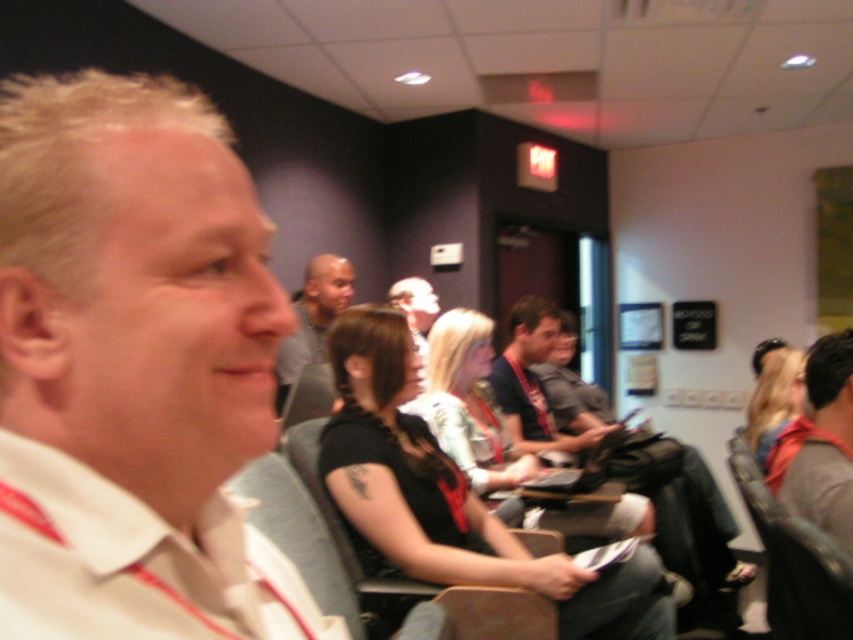
In the scene shown: Can you confirm if white cotton shirt at left is wider than gray fabric shirt at center?

No, white cotton shirt at left is not wider than gray fabric shirt at center.

Find the location of a particular element. The image size is (853, 640). white cotton shirt at left is located at coordinates (135, 563).

Which is behind, point (239, 509) or point (318, 324)?

The point (318, 324) is behind.

The height and width of the screenshot is (640, 853). I want to click on white cotton shirt at left, so click(135, 563).

Does dark blue t-shirt at center have a greater width compared to gray fabric chair at center?

Correct, the width of dark blue t-shirt at center exceeds that of gray fabric chair at center.

Can you confirm if dark blue t-shirt at center is taller than gray fabric chair at center?

Yes.

Between point (535, 520) and point (486, 637), which one is positioned in front?

Point (486, 637) is in front.

You are a GUI agent. You are given a task and a screenshot of the screen. Output one action in this format:
    pyautogui.click(x=<x>, y=<y>)
    Task: Click on the dark blue t-shirt at center
    This screenshot has width=853, height=640.
    Given the screenshot: What is the action you would take?
    pyautogui.click(x=534, y=385)

Is black leather chair at lower right in front of gray fabric shirt at center?

Yes, black leather chair at lower right is in front of gray fabric shirt at center.

Is point (811, 618) farther from camera compared to point (297, 369)?

No, (811, 618) is in front of (297, 369).

Locate an element on the screen. black leather chair at lower right is located at coordinates pyautogui.click(x=793, y=561).